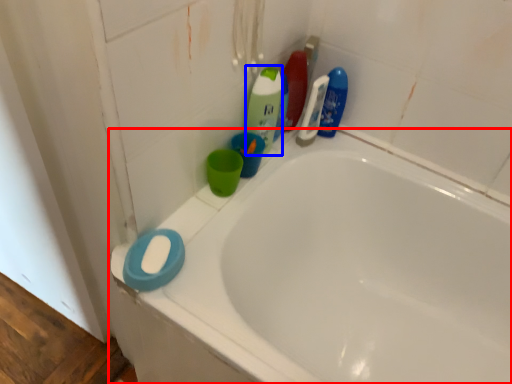
Question: Among these objects, which one is farthest to the camera, bathtub (highlighted by a red box) or cleaning product (highlighted by a blue box)?

Choices:
 (A) bathtub
 (B) cleaning product

Answer: (B)